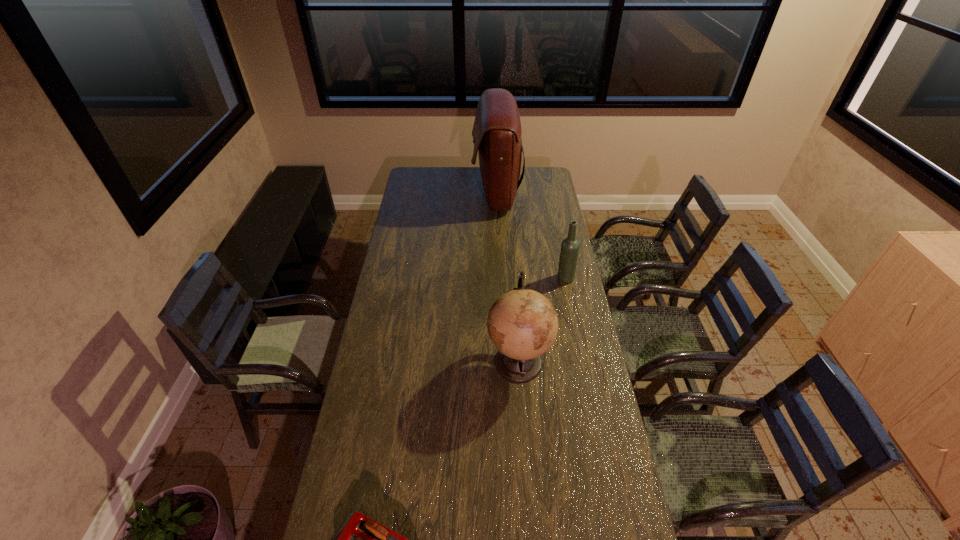
Identify the location of satchel. The width and height of the screenshot is (960, 540). (497, 132).

This screenshot has width=960, height=540. Identify the location of the tallest object. (497, 132).

At what (x,y) coordinates should I click in order to perform the action: click on the third farthest object. Please return your answer as a coordinate pair (x, y). This screenshot has height=540, width=960. Looking at the image, I should click on (522, 324).

Identify the location of the rightmost object. (570, 246).

Identify the location of the third tallest object. The image size is (960, 540). (570, 246).

Find the location of `vacant space located on the open flap of the tallest object`. vacant space located on the open flap of the tallest object is located at coordinates (433, 193).

Where is `free space located 0.270m on the open flap of the tallest object`? Image resolution: width=960 pixels, height=540 pixels. free space located 0.270m on the open flap of the tallest object is located at coordinates (426, 193).

Image resolution: width=960 pixels, height=540 pixels. What are the coordinates of `vacant area located 0.280m on the open flap of the tallest object` in the screenshot? It's located at (424, 193).

You are a GUI agent. You are given a task and a screenshot of the screen. Output one action in this format:
    pyautogui.click(x=<x>, y=<y>)
    Task: Click on the vacant space positioned 0.170m on the front-facing side of the globe
    
    Given the screenshot: What is the action you would take?
    pyautogui.click(x=443, y=361)

The height and width of the screenshot is (540, 960). What are the coordinates of `free space located on the front-facing side of the globe` in the screenshot? It's located at (453, 361).